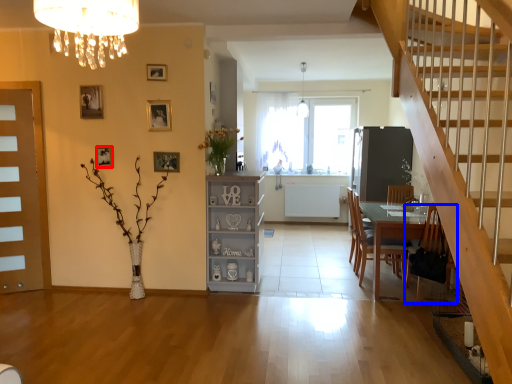
Question: Which point is closer to the camera, picture frame (highlighted by a red box) or chair (highlighted by a blue box)?

Choices:
 (A) picture frame
 (B) chair

Answer: (B)